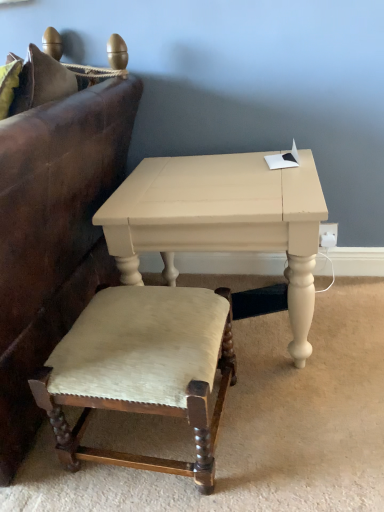
Locate an element on the screen. vacant area on top of velvet upholstered stool at lower left (from a real-world perspective) is located at coordinates (134, 327).